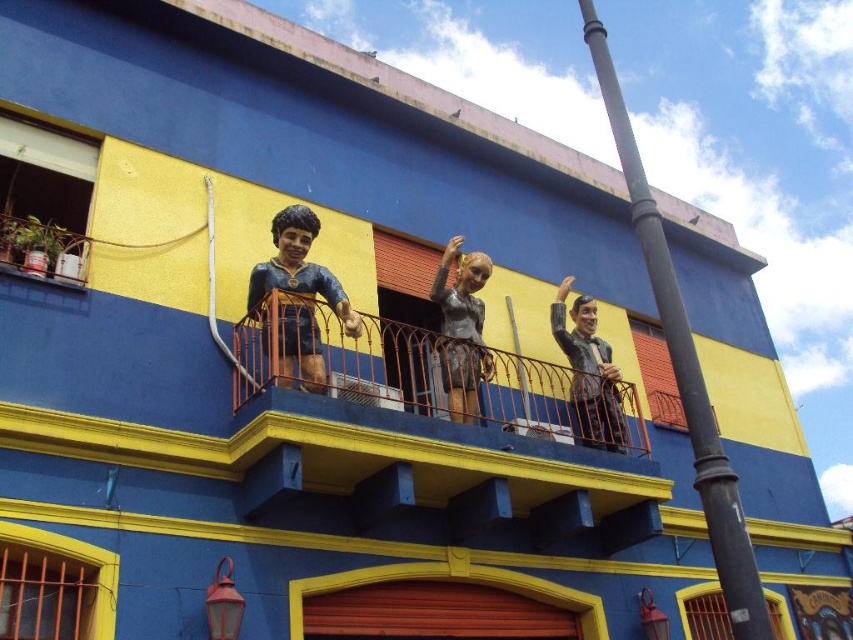
Between point (445, 344) and point (581, 404), which one is positioned in front?

Point (445, 344) is in front.

Is point (471, 278) closer to viewer compared to point (584, 387)?

Yes, it is.

What are the coordinates of `shiny silver statue at center` in the screenshot? It's located at (462, 328).

This screenshot has width=853, height=640. I want to click on shiny gold statue at center, so click(x=297, y=298).

Does point (252, 307) come farther from viewer compared to point (556, 312)?

No, it is in front of (556, 312).

Find the location of a particular element. The height and width of the screenshot is (640, 853). shiny gold statue at center is located at coordinates (297, 298).

Which is behind, point (396, 348) or point (608, 404)?

The point (608, 404) is behind.

Does orange metal railing at upper center have a larger size compared to shiny black suit at upper right?

Yes.

Between point (556, 390) and point (592, 342), which one is positioned behind?

Positioned behind is point (592, 342).

You are a GUI agent. You are given a task and a screenshot of the screen. Output one action in this format:
    pyautogui.click(x=<x>, y=<y>)
    Task: Click on the orange metal railing at upper center
    This screenshot has height=640, width=853.
    Given the screenshot: What is the action you would take?
    pyautogui.click(x=434, y=376)